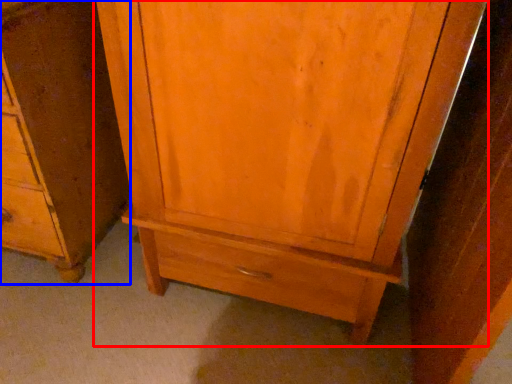
Question: Which object is closer to the camera taking this photo, cupboard (highlighted by a red box) or chest of drawers (highlighted by a blue box)?

Choices:
 (A) cupboard
 (B) chest of drawers

Answer: (A)